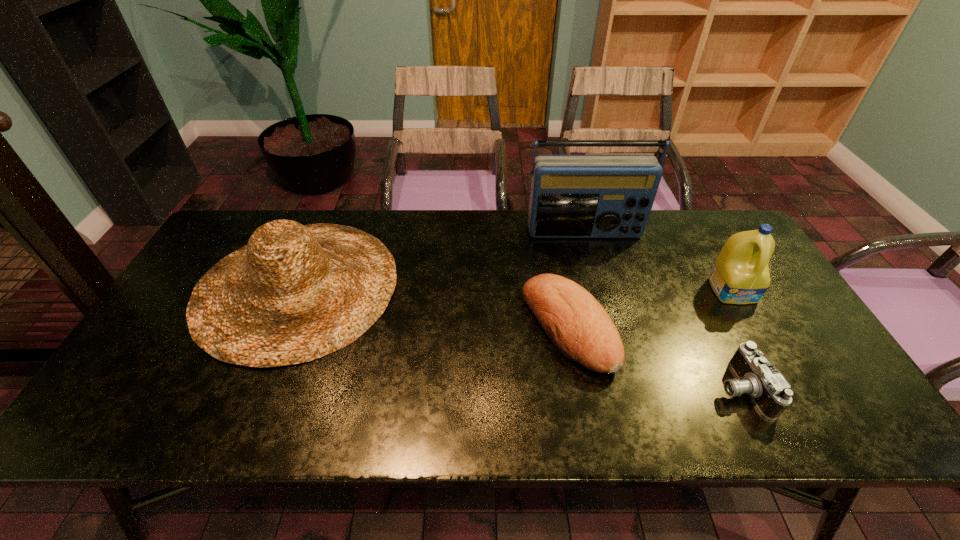
Identify the location of vacant space in between the radio receiver and the bread. (576, 280).

Where is `vacant area that lies between the detergent and the third tallest object`? vacant area that lies between the detergent and the third tallest object is located at coordinates (516, 288).

Locate an element on the screen. The height and width of the screenshot is (540, 960). blank region between the detergent and the camera is located at coordinates (737, 340).

The width and height of the screenshot is (960, 540). In order to click on free spot between the camera and the detergent in this screenshot , I will do `click(737, 340)`.

This screenshot has width=960, height=540. I want to click on free area in between the sunhat and the detergent, so click(x=516, y=288).

Identify which object is the second nearest to the detergent. Please provide its 2D coordinates. Your answer should be formatted as a tuple, i.e. [(x, y)], where the tuple contains the x and y coordinates of a point satisfying the conditions above.

[(572, 196)]

The image size is (960, 540). I want to click on the closest object relative to the detergent, so click(770, 392).

Image resolution: width=960 pixels, height=540 pixels. What are the coordinates of `vacant space that satisfies the following two spatial constraints: 1. on the label of the detergent; 2. at the lens of the camera` in the screenshot? It's located at pos(789,388).